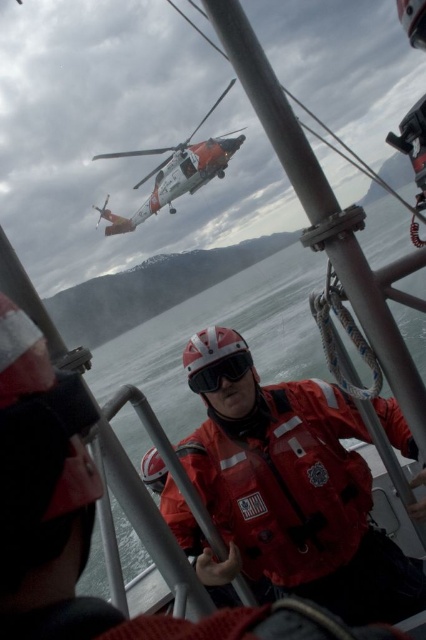
I want to click on red matte life jacket at center, so click(x=287, y=481).

Does red matte life jacket at center have a lesser width compared to black matte goggles at center?

In fact, red matte life jacket at center might be wider than black matte goggles at center.

Between point (333, 564) and point (235, 353), which one is positioned behind?

Point (235, 353)

Locate an element on the screen. This screenshot has width=426, height=640. red matte life jacket at center is located at coordinates (287, 481).

Measure the distance from orange matte helicopter at upper center to black matte goggles at center.

The distance of orange matte helicopter at upper center from black matte goggles at center is 23.41 meters.

Which is behind, point (189, 182) or point (203, 371)?

Point (189, 182)

Is point (147, 208) more distant than point (218, 358)?

Yes.

At what (x,y) coordinates should I click in order to perform the action: click on orange matte helicopter at upper center. Please return your answer as a coordinate pair (x, y). This screenshot has width=426, height=640. Looking at the image, I should click on (175, 172).

Who is more distant from viewer, [313,566] or [184,172]?

Positioned behind is point [184,172].

Who is taller, red matte life jacket at center or orange matte helicopter at upper center?

Standing taller between the two is orange matte helicopter at upper center.

Is point (302, 545) more distant than point (201, 156)?

No, it is in front of (201, 156).

The width and height of the screenshot is (426, 640). I want to click on red matte life jacket at center, so click(x=287, y=481).